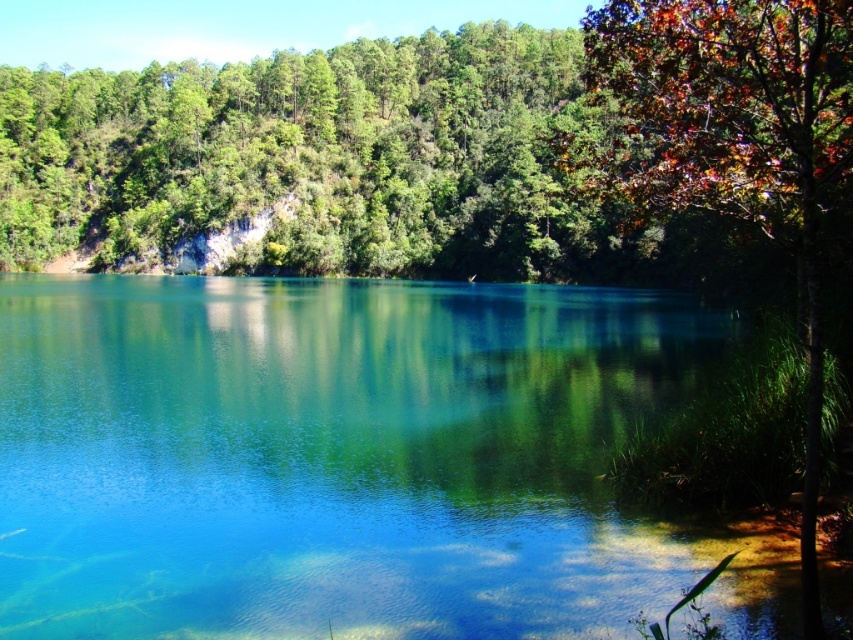
Question: Is the position of transparent water at center less distant than that of autumn leaves at right?

Choices:
 (A) yes
 (B) no

Answer: (B)

Question: Which point is closer to the camera?

Choices:
 (A) (805, 74)
 (B) (428, 378)

Answer: (A)

Question: Is transparent water at center bigger than autumn leaves at right?

Choices:
 (A) no
 (B) yes

Answer: (A)

Question: Is transparent water at center further to camera compared to autumn leaves at right?

Choices:
 (A) no
 (B) yes

Answer: (B)

Question: Which of the following is the closest to the observer?

Choices:
 (A) (151, 584)
 (B) (648, 173)

Answer: (A)